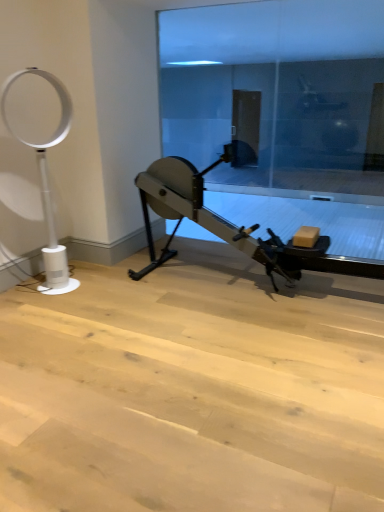
Identify the location of vacant point to the left of metallic gray stationary bicycle at center. (108, 308).